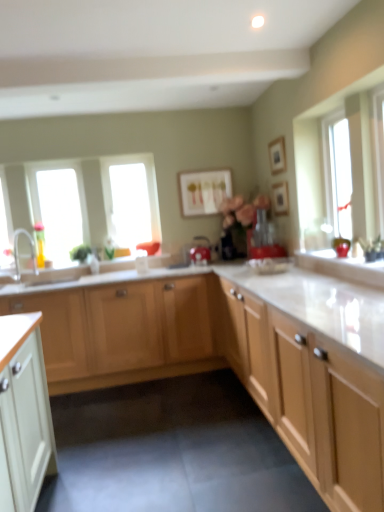
Question: Looking at their shapes, would you say matte red blender at center, arranged as the 2th appliance when viewed from the left, is wider or thinner than light wood cabinet at center, which is the 1th cabinetry from back to front?

Choices:
 (A) thin
 (B) wide

Answer: (A)

Question: In the image, is matte red blender at center, the first appliance in the right-to-left sequence, positioned in front of or behind light wood cabinet at center, which is the 1th cabinetry from back to front?

Choices:
 (A) behind
 (B) front

Answer: (A)

Question: Which object is positioned closest to the silver metallic faucet at left?

Choices:
 (A) matte white picture frame at center, the third picture frame viewed from the front
 (B) light wood cabinet at center, the 2th cabinetry positioned from the back
 (C) transparent glass window at left, which is counted as the third window, starting from the right
 (D) wooden picture frame at upper center, the second picture frame when ordered from right to left
 (E) transparent glass window at center, positioned as the 1th window in back-to-front order

Answer: (C)

Question: Based on their relative distances, which object is nearer to the matte red kettle at center, the second appliance in the front-to-back sequence?

Choices:
 (A) transparent glass window at left, which is counted as the 2th window, starting from the back
 (B) wooden picture frame at upper center, the third picture frame in the left-to-right sequence
 (C) light wood cabinet at center, the 2th cabinetry viewed from the front
 (D) matte white picture frame at center, the 1th picture frame in the back-to-front sequence
 (E) matte red blender at center, arranged as the 2th appliance when viewed from the left

Answer: (D)